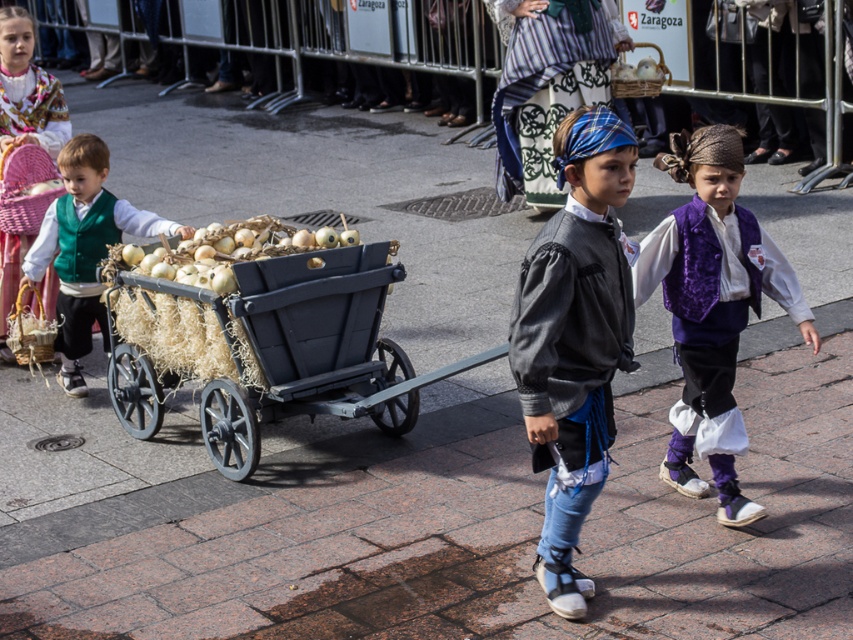
Question: Does gray fabric shirt at center have a lesser width compared to beige straw hay at center?

Choices:
 (A) no
 (B) yes

Answer: (B)

Question: Which point is closer to the camera?

Choices:
 (A) purple velvet vest at center
 (B) black wooden wagon at center

Answer: (A)

Question: Which object is positioned closest to the black wooden wagon at center?

Choices:
 (A) matte pink wicker basket at upper left
 (B) gray fabric shirt at center
 (C) purple velvet vest at center
 (D) green velvet vest at left

Answer: (D)

Question: Which of the following is the farthest from the observer?

Choices:
 (A) (82, 180)
 (B) (596, 154)

Answer: (A)

Question: Can you confirm if gray fabric shirt at center is positioned to the left of green velvet vest at left?

Choices:
 (A) no
 (B) yes

Answer: (A)

Question: Where is purple velvet vest at center located in relation to beige straw hay at center in the image?

Choices:
 (A) above
 (B) below

Answer: (A)